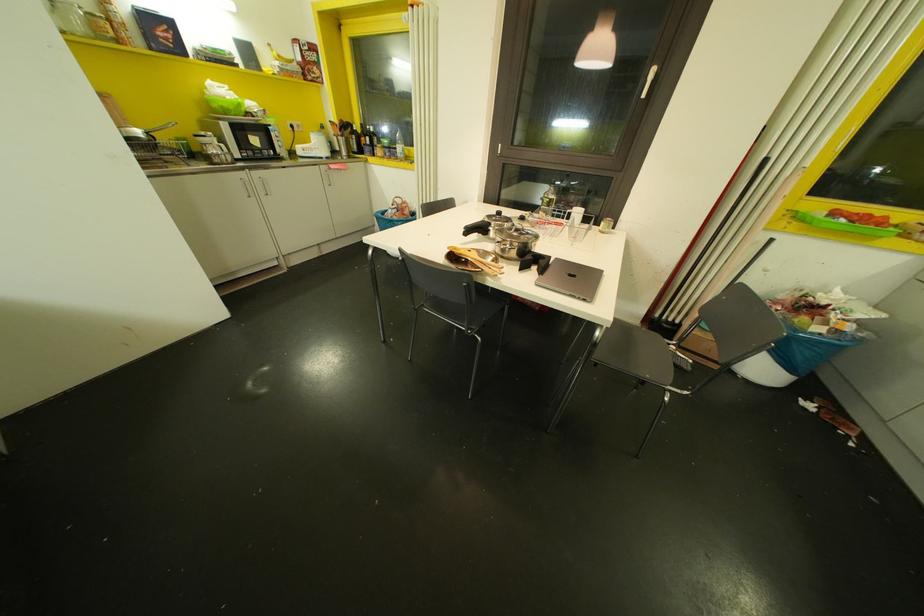
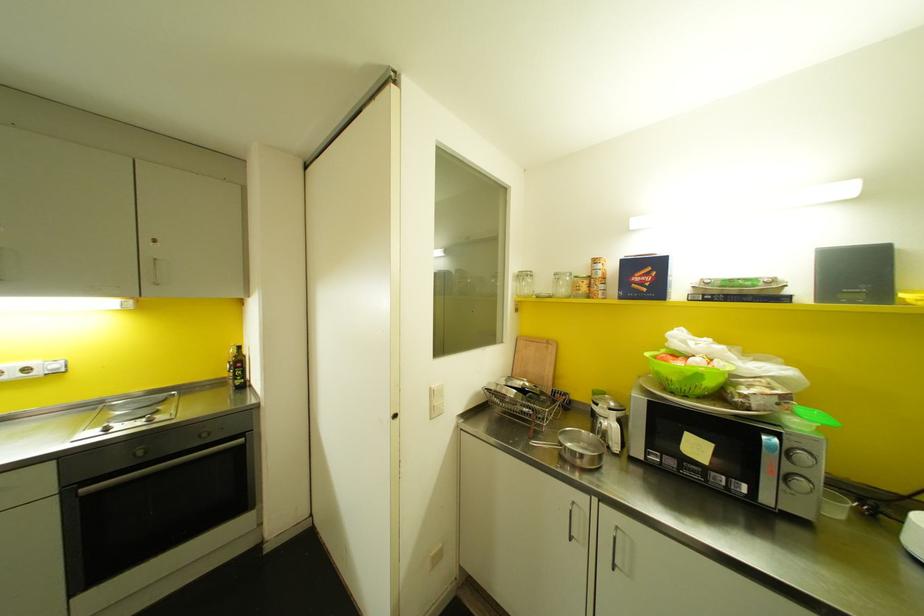
In the second image, find the point that corresponds to (117,42) in the first image.

(588, 294)